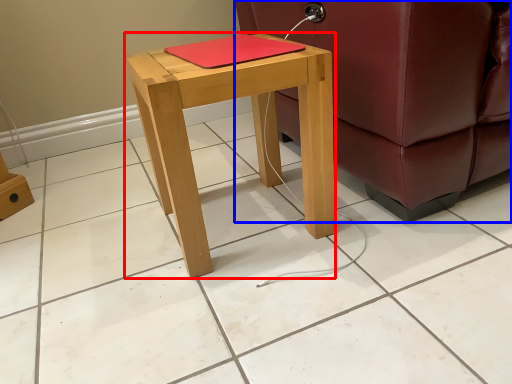
Question: Which object appears farthest to the camera in this image, stool (highlighted by a red box) or studio couch (highlighted by a blue box)?

Choices:
 (A) stool
 (B) studio couch

Answer: (A)